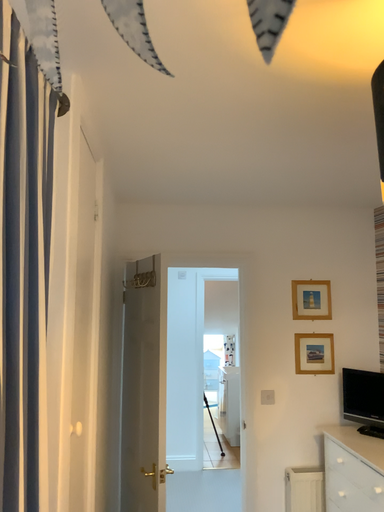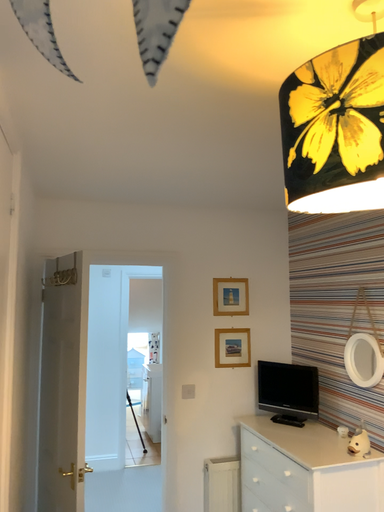
Question: Which way did the camera rotate in the video?

Choices:
 (A) rotated right
 (B) rotated left

Answer: (A)